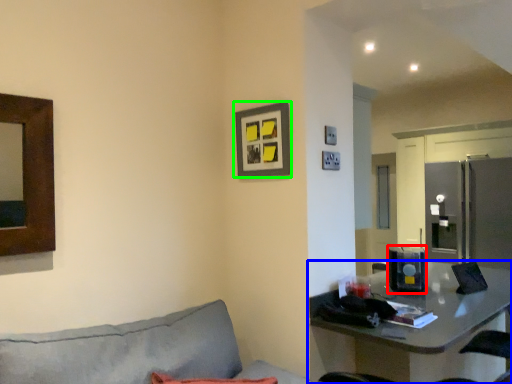
Question: Which object is positioned farthest from appliance (highlighted by a red box)? Select from table (highlighted by a blue box) and picture frame (highlighted by a green box).

Choices:
 (A) table
 (B) picture frame

Answer: (B)